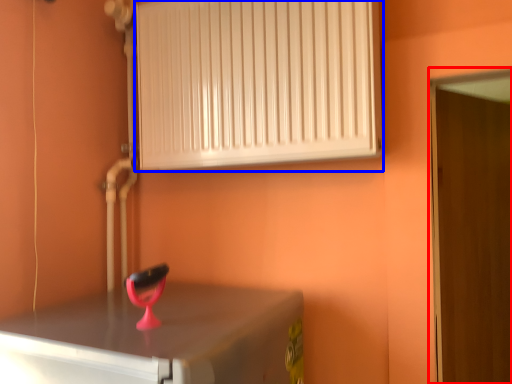
Question: Which of the following is the farthest to the observer, door (highlighted by a red box) or radiator (highlighted by a blue box)?

Choices:
 (A) door
 (B) radiator

Answer: (A)